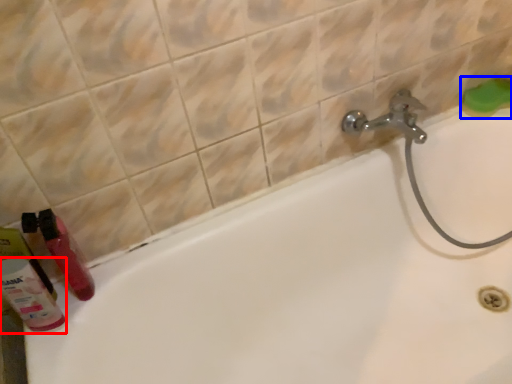
Question: Which object appears farthest to the camera in this image, cleaning product (highlighted by a red box) or soap (highlighted by a blue box)?

Choices:
 (A) cleaning product
 (B) soap

Answer: (B)